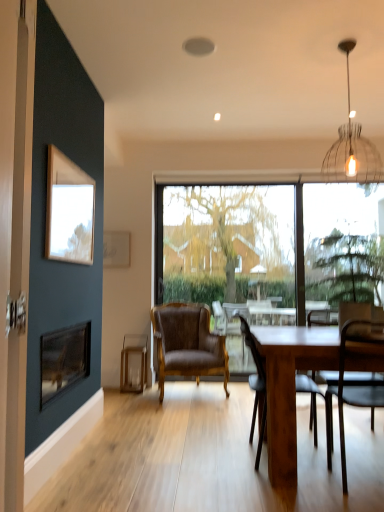
The height and width of the screenshot is (512, 384). Identify the location of empty space that is in between metallic dark brown chair at right, arranged as the 1th chair when viewed from the front, and wooden table at center. (319, 496).